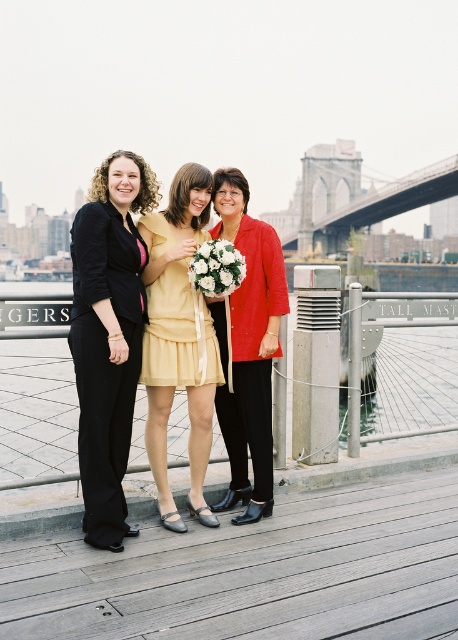
Question: Which of these objects is positioned farthest from the yellow satin dress at center?

Choices:
 (A) matte black pants at left
 (B) matte yellow dress at center
 (C) matte red blazer at center
 (D) wooden at center

Answer: (D)

Question: Can you confirm if wooden at center is positioned to the left of matte yellow dress at center?

Choices:
 (A) no
 (B) yes

Answer: (A)

Question: Among these points, which one is nearest to the camera?

Choices:
 (A) (108, 433)
 (B) (196, 250)

Answer: (A)

Question: Can you confirm if matte black pants at left is bigger than matte red blazer at center?

Choices:
 (A) no
 (B) yes

Answer: (A)

Question: Estimate the real-world distances between objects in this image. Which object is closer to the matte black pants at left?

Choices:
 (A) yellow satin dress at center
 (B) matte yellow dress at center

Answer: (A)

Question: In this image, where is matte black pants at left located relative to matte red blazer at center?

Choices:
 (A) right
 (B) left

Answer: (B)